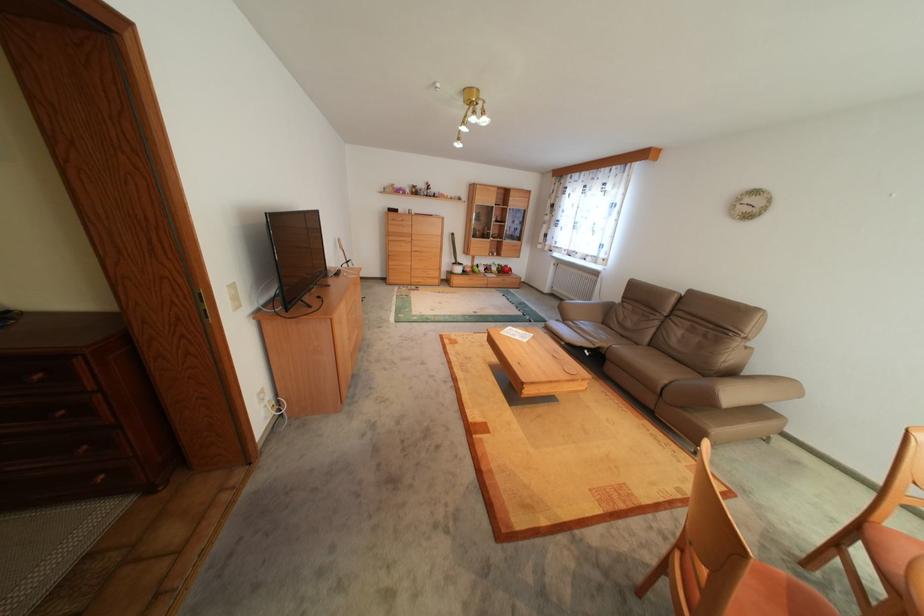
Where would you pull the round drawer knob? Please return your answer as a coordinate pair (x, y).

(34, 377)